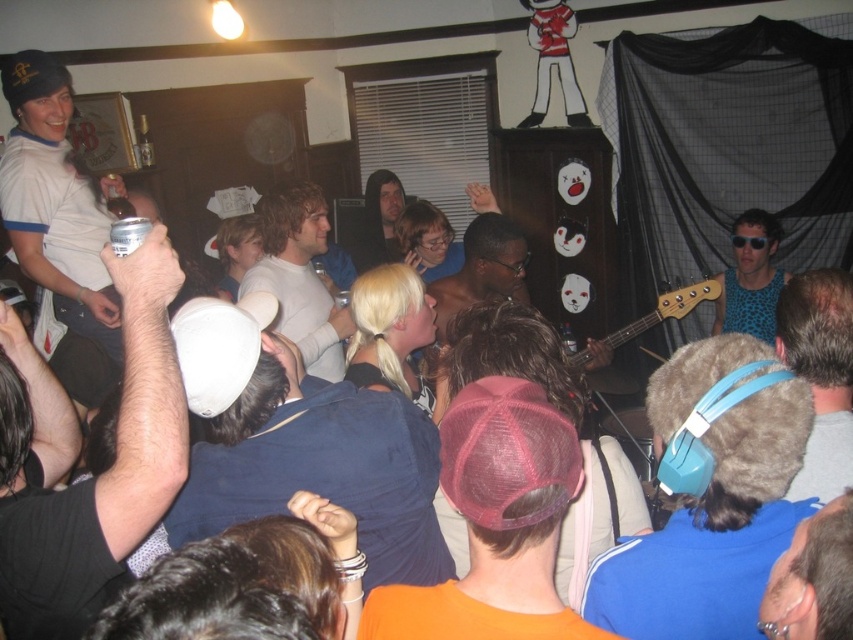
Does point (200, 340) come closer to viewer compared to point (813, 420)?

No, (200, 340) is behind (813, 420).

Who is lower down, white fabric cap at center or brown fur hat at upper right?

Positioned lower is white fabric cap at center.

Does point (421, 413) come closer to viewer compared to point (798, 488)?

No.

At what (x,y) coordinates should I click in order to perform the action: click on white fabric cap at center. Please return your answer as a coordinate pair (x, y). The height and width of the screenshot is (640, 853). Looking at the image, I should click on (303, 444).

Who is positioned more to the left, white matte t-shirt at center or leopard print tank top at upper right?

Positioned to the left is white matte t-shirt at center.

Who is taller, white matte t-shirt at center or leopard print tank top at upper right?

white matte t-shirt at center is taller.

Locate an element on the screen. The width and height of the screenshot is (853, 640). white matte t-shirt at center is located at coordinates (299, 276).

At what (x,y) coordinates should I click in order to perform the action: click on white matte t-shirt at center. Please return your answer as a coordinate pair (x, y). This screenshot has height=640, width=853. Looking at the image, I should click on (299, 276).

Is point (170, 365) positioned before point (45, 298)?

Yes, it is.

Is matte white can at upper left closer to camera compared to matte white cap at upper left?

That is True.

The height and width of the screenshot is (640, 853). I want to click on matte white can at upper left, so click(x=77, y=452).

Where is `matte white can at upper left`? The image size is (853, 640). matte white can at upper left is located at coordinates (77, 452).